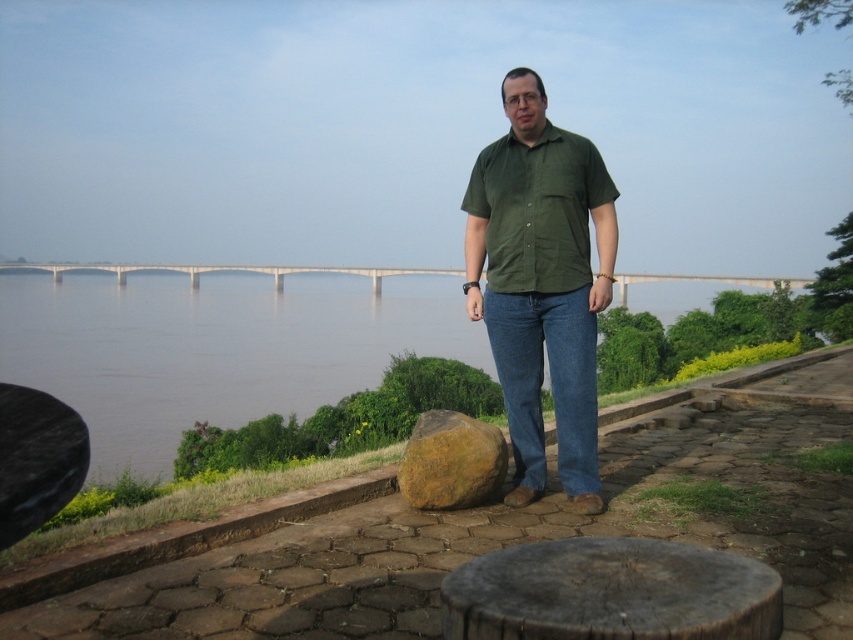
Which is above, brown muddy water at center or brown rough rock at center?

brown muddy water at center is above.

Is point (314, 404) positioned after point (462, 461)?

Yes, point (314, 404) is behind point (462, 461).

The width and height of the screenshot is (853, 640). Identify the location of brown muddy water at center. (215, 348).

Is point (508, 307) farther from camera compared to point (723, 598)?

Yes.

Can you confirm if green matte shirt at center is thinner than dark brown wood stool at lower center?

Indeed, green matte shirt at center has a lesser width compared to dark brown wood stool at lower center.

Which is in front, point (558, 284) or point (627, 564)?

Positioned in front is point (627, 564).

Where is `green matte shirt at center`? This screenshot has height=640, width=853. green matte shirt at center is located at coordinates (541, 284).

Which of these two, dark brown wood stool at lower center or green cotton shirt at center, stands taller?

green cotton shirt at center

Is point (554, 557) closer to viewer compared to point (550, 161)?

Yes, it is.

Who is more distant from viewer, (x=566, y=620) or (x=564, y=259)?

Point (x=564, y=259)

Locate an element on the screen. The image size is (853, 640). dark brown wood stool at lower center is located at coordinates (610, 593).